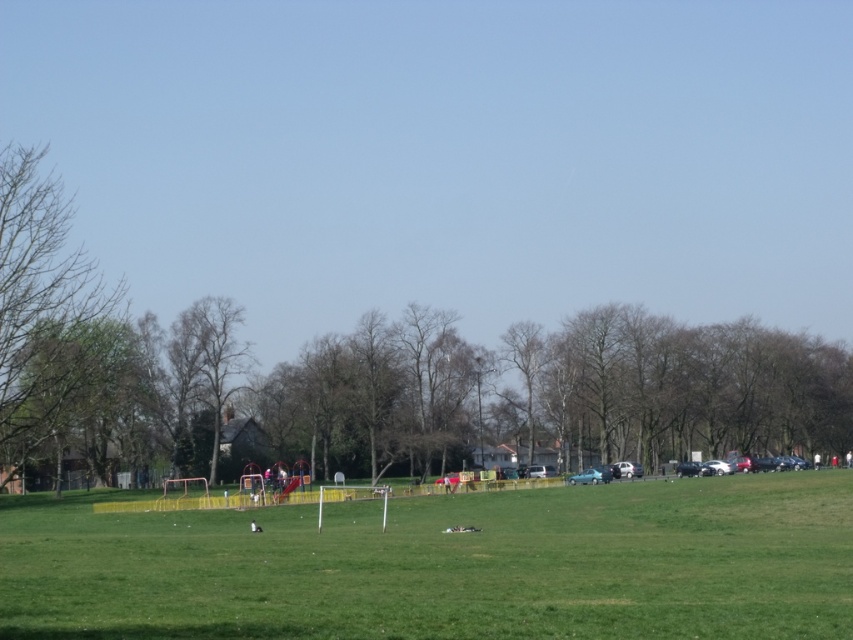
Is green grassy field at center bigger than brown wood tree at center?

Yes, green grassy field at center is bigger than brown wood tree at center.

Which is below, green grassy field at center or brown wood tree at center?

green grassy field at center is lower down.

At what (x,y) coordinates should I click in order to perform the action: click on green grassy field at center. Please return your answer as a coordinate pair (x, y). This screenshot has height=640, width=853. Looking at the image, I should click on (445, 564).

Which is below, green leafy tree at left or brown wood tree at center?

brown wood tree at center is below.

Find the location of a particular element. green leafy tree at left is located at coordinates (45, 310).

Between point (300, 532) and point (22, 372), which one is positioned in front?

Point (22, 372) is more forward.

Can you confirm if green grassy field at center is thinner than green leafy tree at left?

In fact, green grassy field at center might be wider than green leafy tree at left.

Is point (643, 557) positioned after point (7, 416)?

Yes, point (643, 557) is behind point (7, 416).

I want to click on green grassy field at center, so click(445, 564).